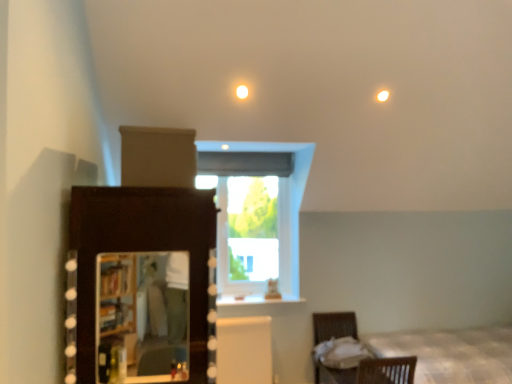
Question: Is white fabric at lower right inside the boundaries of brown wicker basket at lower right, or outside?

Choices:
 (A) inside
 (B) outside

Answer: (A)

Question: Considering the positions of white fabric at lower right and brown wicker basket at lower right in the image, is white fabric at lower right wider or thinner than brown wicker basket at lower right?

Choices:
 (A) thin
 (B) wide

Answer: (A)

Question: Considering the real-world distances, which object is farthest from the dark wood dresser at left?

Choices:
 (A) matte wooden mirror at lower left
 (B) transparent glass window at center
 (C) brown wicker basket at lower right
 (D) white fabric at lower right
 (E) white fabric bed at lower right

Answer: (E)

Question: Considering the real-world distances, which object is farthest from the brown wicker basket at lower right?

Choices:
 (A) transparent glass window at center
 (B) matte wooden mirror at lower left
 (C) dark wood dresser at left
 (D) white fabric bed at lower right
 (E) white fabric at lower right

Answer: (C)